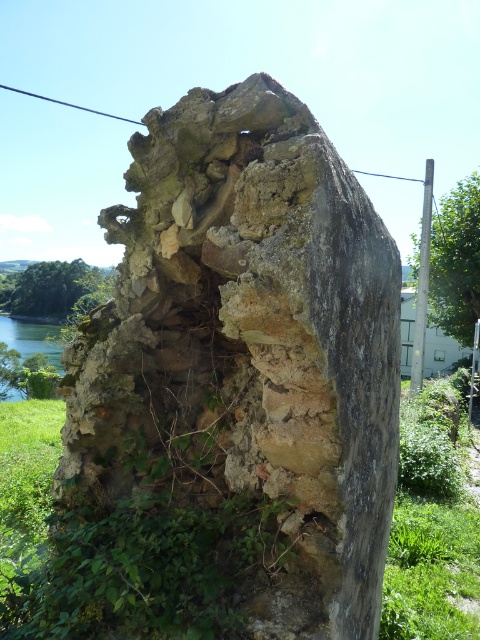
Locate an element on the screen. weathered stone wall at center is located at coordinates (250, 348).

Does weathered stone wall at center have a lesser height compared to green leafy vegetation at left?

Yes, weathered stone wall at center is shorter than green leafy vegetation at left.

Between point (301, 589) and point (78, 285), which one is positioned in front?

Positioned in front is point (301, 589).

Find the location of `weathered stone wall at center`. weathered stone wall at center is located at coordinates (250, 348).

Which of these two, weathered stone wall at center or green water at left, stands taller?

Standing taller between the two is green water at left.

Does weathered stone wall at center have a lesser height compared to green water at left?

Yes, weathered stone wall at center is shorter than green water at left.

Identify the location of weathered stone wall at center. (250, 348).

Who is lower down, green leafy vegetation at right or green leafy vegetation at left?

green leafy vegetation at left

Which of these two, green leafy vegetation at right or green leafy vegetation at left, stands taller?

Standing taller between the two is green leafy vegetation at right.

Find the location of `green leafy vegetation at right`. green leafy vegetation at right is located at coordinates (456, 260).